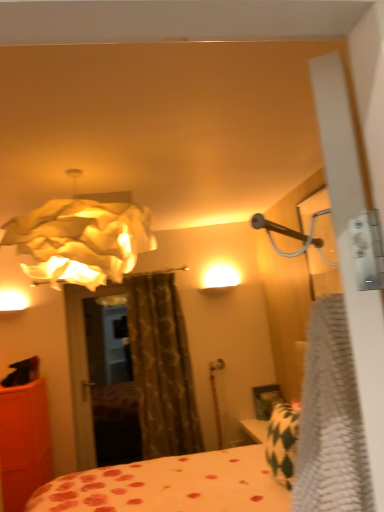
Question: Is white textured blanket at right bigger than orange matte cabinet at left?

Choices:
 (A) no
 (B) yes

Answer: (A)

Question: From the image's perspective, does white textured blanket at right appear lower than orange matte cabinet at left?

Choices:
 (A) no
 (B) yes

Answer: (A)

Question: From a real-world perspective, is white textured blanket at right below orange matte cabinet at left?

Choices:
 (A) yes
 (B) no

Answer: (B)

Question: Considering the relative sizes of white textured blanket at right and orange matte cabinet at left in the image provided, is white textured blanket at right taller than orange matte cabinet at left?

Choices:
 (A) no
 (B) yes

Answer: (A)

Question: Considering the relative sizes of white textured blanket at right and orange matte cabinet at left in the image provided, is white textured blanket at right smaller than orange matte cabinet at left?

Choices:
 (A) yes
 (B) no

Answer: (A)

Question: Considering the positions of point (66, 275) and point (236, 501), is point (66, 275) closer or farther from the camera than point (236, 501)?

Choices:
 (A) farther
 (B) closer

Answer: (B)

Question: Considering their positions, is white paper lampshade at upper left located in front of or behind polka dot fabric bed at center?

Choices:
 (A) front
 (B) behind

Answer: (B)

Question: From a real-world perspective, relative to polka dot fabric bed at center, is white paper lampshade at upper left vertically above or below?

Choices:
 (A) above
 (B) below

Answer: (A)

Question: Considering the positions of white paper lampshade at upper left and polka dot fabric bed at center in the image, is white paper lampshade at upper left taller or shorter than polka dot fabric bed at center?

Choices:
 (A) short
 (B) tall

Answer: (A)

Question: Considering the positions of brown textured curtain at center and orange matte cabinet at left in the image, is brown textured curtain at center taller or shorter than orange matte cabinet at left?

Choices:
 (A) short
 (B) tall

Answer: (B)

Question: Would you say brown textured curtain at center is to the left or to the right of orange matte cabinet at left in the picture?

Choices:
 (A) right
 (B) left

Answer: (A)

Question: From the image's perspective, is brown textured curtain at center positioned above or below orange matte cabinet at left?

Choices:
 (A) above
 (B) below

Answer: (A)

Question: From a real-world perspective, is brown textured curtain at center physically located above or below orange matte cabinet at left?

Choices:
 (A) above
 (B) below

Answer: (A)

Question: Is orange matte cabinet at left bigger or smaller than white paper lampshade at upper left?

Choices:
 (A) big
 (B) small

Answer: (A)

Question: Is orange matte cabinet at left taller or shorter than white paper lampshade at upper left?

Choices:
 (A) tall
 (B) short

Answer: (A)